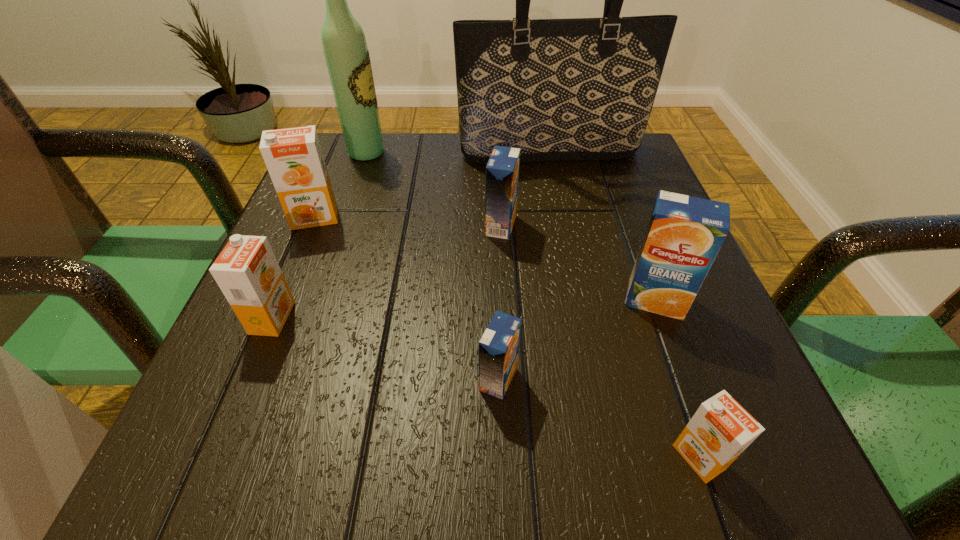
Find the location of a particular element. free region located 0.190m on the back of the smallest orange orange juice is located at coordinates pos(650,313).

Identify the location of tote bag at the far edge. The height and width of the screenshot is (540, 960). (582, 88).

Image resolution: width=960 pixels, height=540 pixels. In order to click on wine bottle at the far edge in this screenshot , I will do `click(346, 52)`.

At what (x,y) coordinates should I click in order to perform the action: click on object located in the near edge section of the desktop. Please return your answer as a coordinate pair (x, y). The height and width of the screenshot is (540, 960). Looking at the image, I should click on (721, 429).

Identify the location of wine bottle that is at the left edge. (346, 52).

Where is `tote bag located at the right edge`? tote bag located at the right edge is located at coordinates (582, 88).

Image resolution: width=960 pixels, height=540 pixels. I want to click on object located in the far left corner section of the desktop, so click(x=346, y=52).

Identify the location of object situated at the far right corner. (582, 88).

Where is `object that is at the near right corner`? This screenshot has width=960, height=540. object that is at the near right corner is located at coordinates (721, 429).

Find the location of `free region at the far edge of the desktop`. free region at the far edge of the desktop is located at coordinates (415, 134).